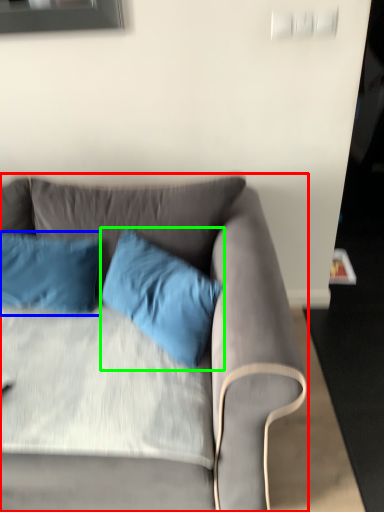
Question: Which object is the farthest from studio couch (highlighted by a red box)? Choose among these: pillow (highlighted by a blue box) or pillow (highlighted by a green box).

Choices:
 (A) pillow
 (B) pillow

Answer: (A)